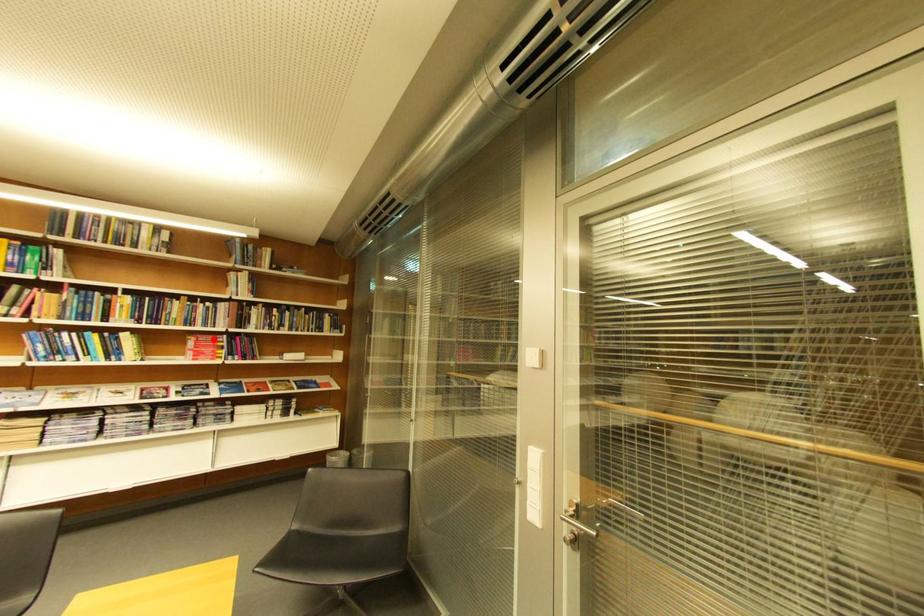
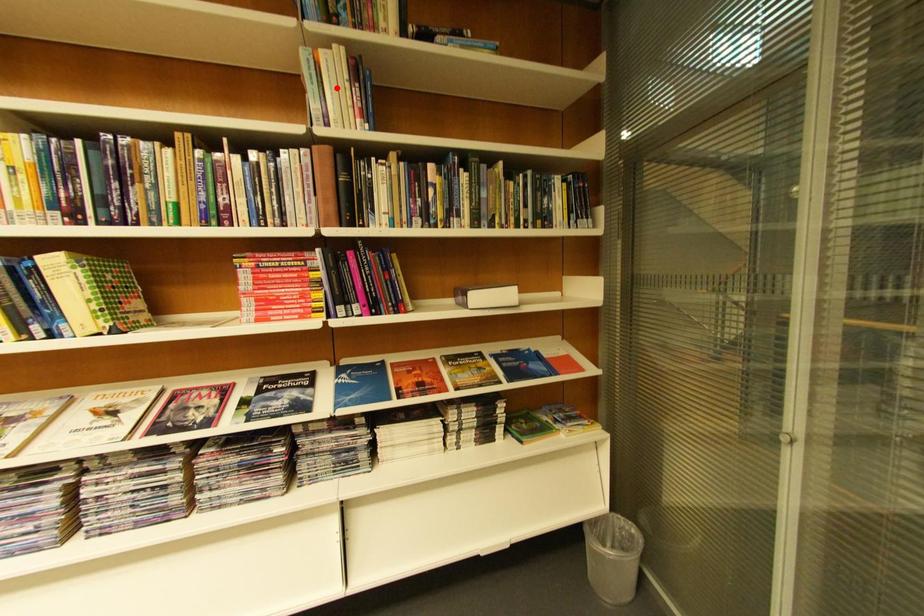
I am providing you with two images of the same scene from different viewpoints. A red point is marked on the first image and another point is marked on the second image. Is the marked point in image1 the same physical position as the marked point in image2?

No